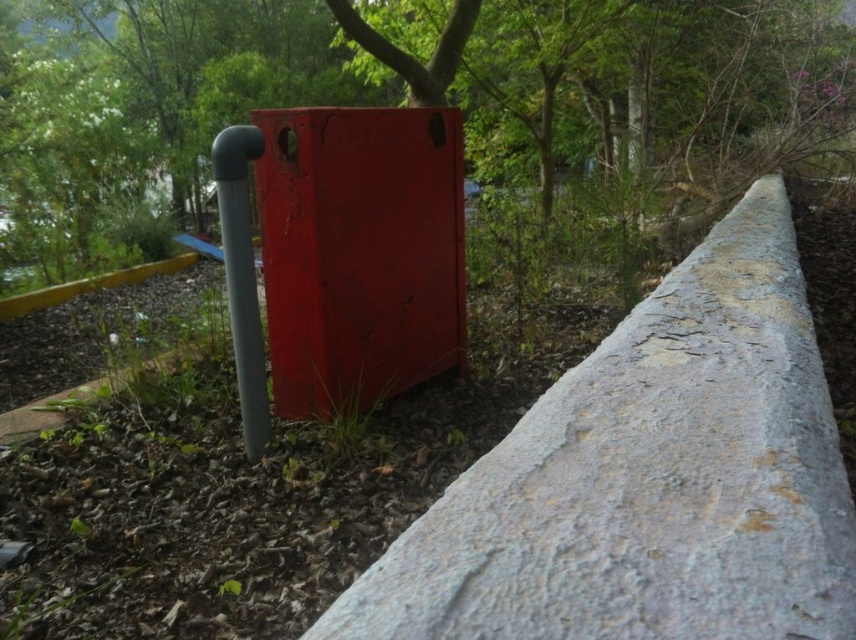
Does green leafy tree at upper center have a larger size compared to matte gray pipe at center-left?

Correct, green leafy tree at upper center is larger in size than matte gray pipe at center-left.

Is point (351, 65) farther from viewer compared to point (220, 177)?

Yes.

Who is more distant from viewer, (666,163) or (251,337)?

The point (666,163) is more distant.

Image resolution: width=856 pixels, height=640 pixels. I want to click on green leafy tree at upper center, so click(x=409, y=102).

Describe the element at coordinates (360, 252) in the screenshot. Image resolution: width=856 pixels, height=640 pixels. I see `matte red box at center` at that location.

This screenshot has width=856, height=640. What are the coordinates of `matte red box at center` in the screenshot? It's located at (360, 252).

How much distance is there between green leafy tree at upper center and matte red box at center?

green leafy tree at upper center and matte red box at center are 9.01 feet apart.

Measure the distance between green leafy tree at upper center and camera.

The distance of green leafy tree at upper center from camera is 2.44 meters.

Locate an element on the screen. The height and width of the screenshot is (640, 856). green leafy tree at upper center is located at coordinates (409, 102).